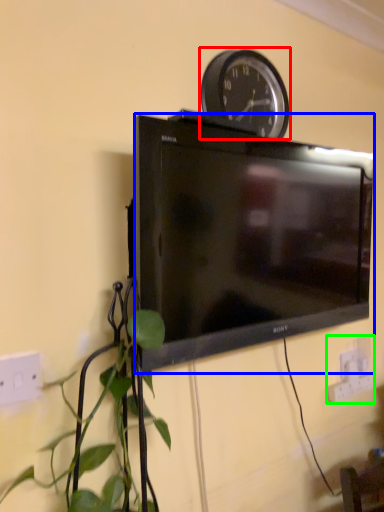
Question: Estimate the real-world distances between objects in this image. Which object is closer to wall clock (highlighted by a red box), television (highlighted by a blue box) or electric outlet (highlighted by a green box)?

Choices:
 (A) television
 (B) electric outlet

Answer: (A)